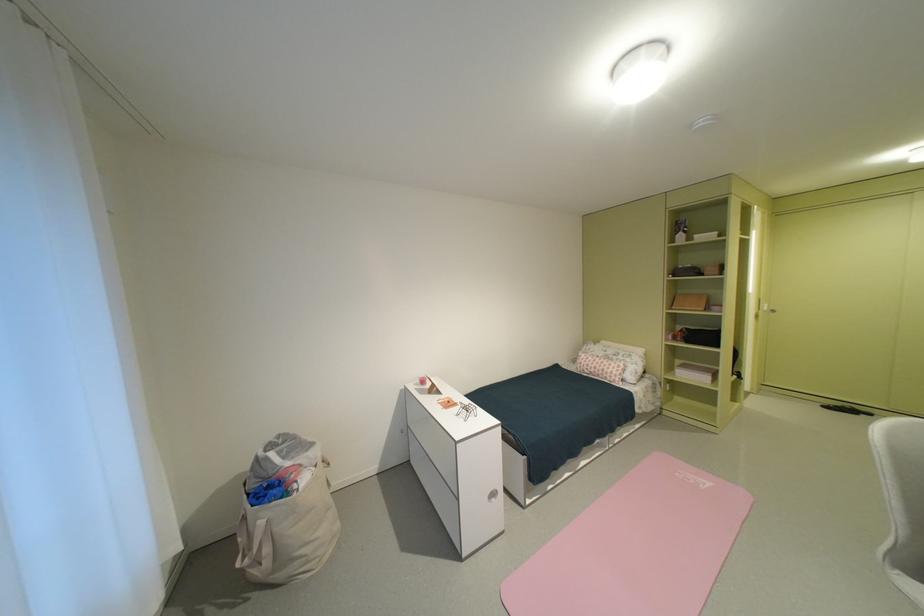
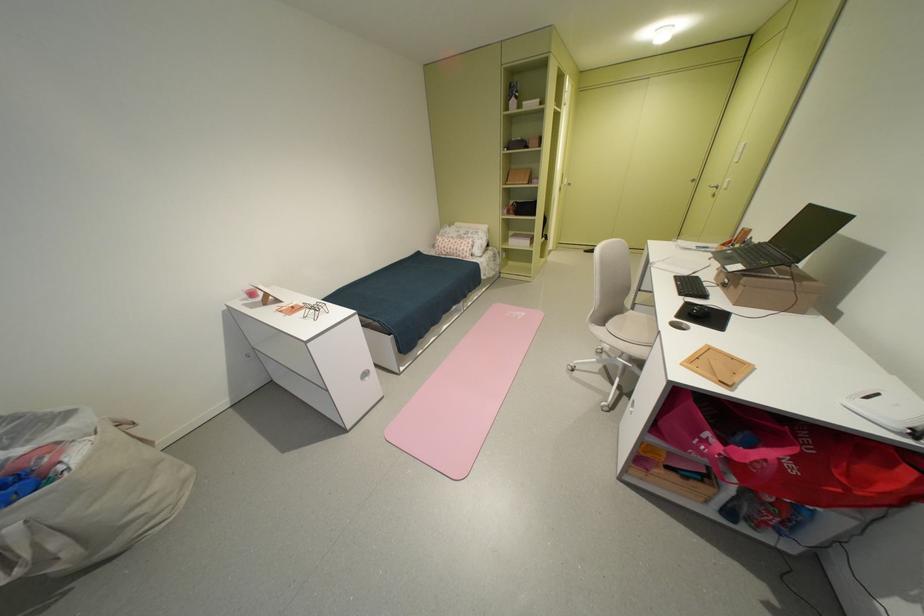
Find the pixel in the second image that matches [616,374] in the first image.

(468, 252)